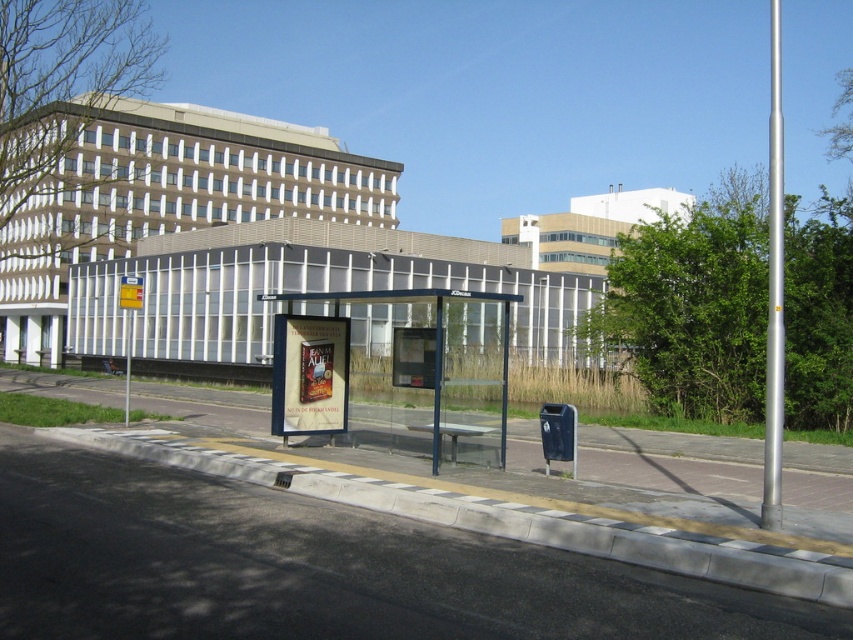
Does gray concrete curb at lower center appear on the right side of transparent glass bus stop at center?

Indeed, gray concrete curb at lower center is positioned on the right side of transparent glass bus stop at center.

Measure the distance from gray concrete curb at lower center to transparent glass bus stop at center.

22.58 feet

Identify the location of gray concrete curb at lower center. This screenshot has width=853, height=640. (506, 518).